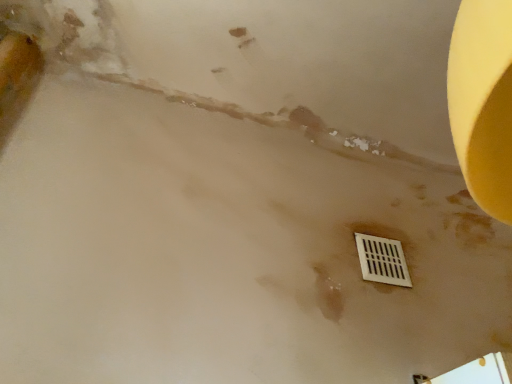
This screenshot has height=384, width=512. What do you see at coordinates (382, 260) in the screenshot?
I see `white plastic vent at center` at bounding box center [382, 260].

Measure the distance between white plastic vent at center and camera.

They are 4.32 feet apart.

Find the location of a particular element. white plastic vent at center is located at coordinates (382, 260).

This screenshot has height=384, width=512. I want to click on white plastic vent at center, so click(382, 260).